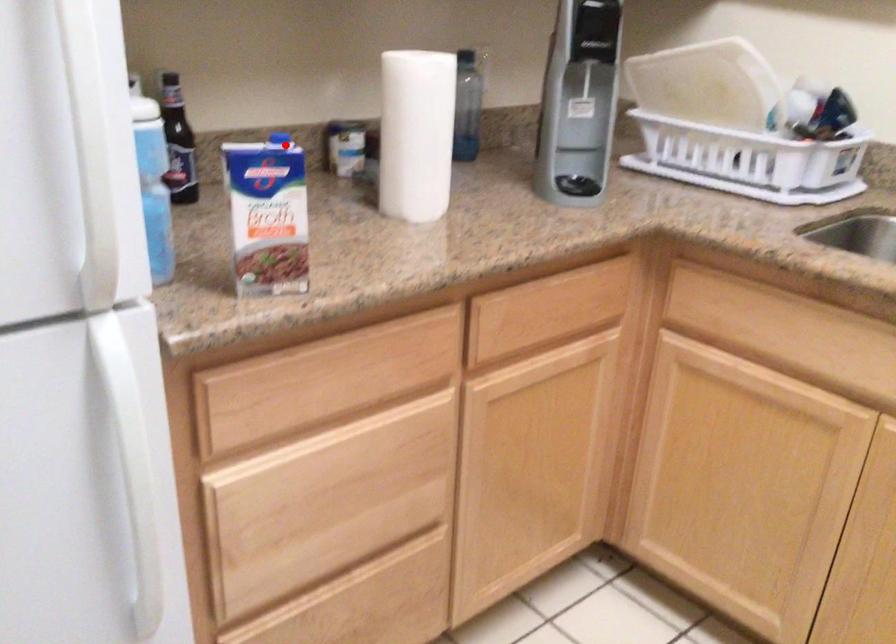
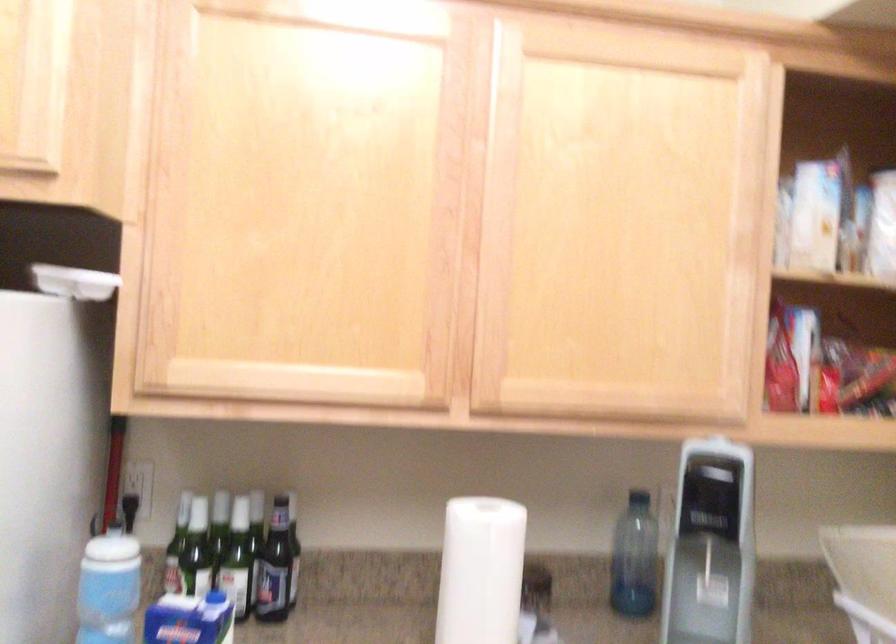
The point at the highlighted location is marked in the first image. Where is the corresponding point in the second image?

(216, 597)